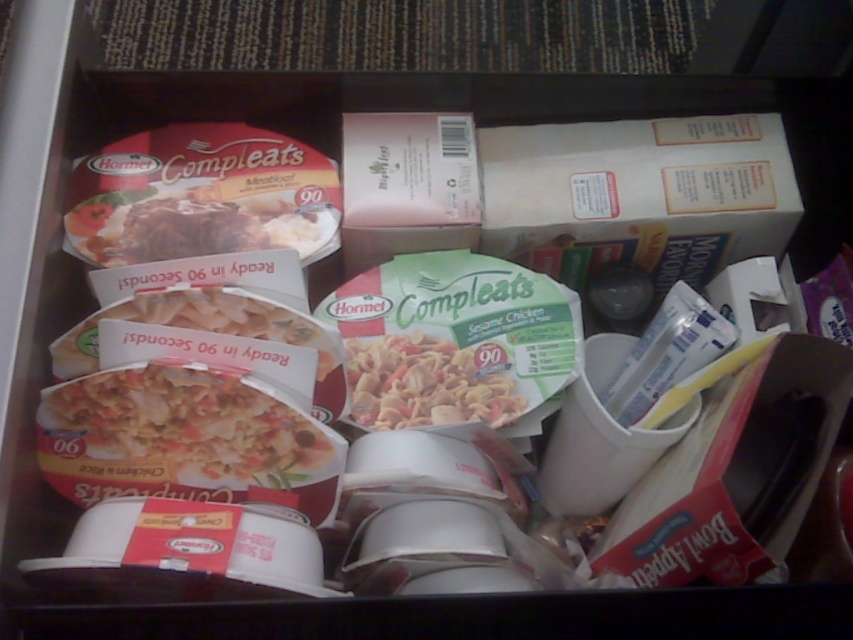
Question: Can you confirm if matte plastic compleats meal at center is thinner than green matte compleats bowl at center?

Choices:
 (A) no
 (B) yes

Answer: (A)

Question: Does white matte compleats at center appear over matte plastic compleats meal at center?

Choices:
 (A) no
 (B) yes

Answer: (A)

Question: Which object is the farthest from the white matte compleats at center?

Choices:
 (A) matte plastic compleats meal at center
 (B) green matte compleats bowl at center

Answer: (A)

Question: Does white matte compleats at center have a greater width compared to green matte compleats bowl at center?

Choices:
 (A) no
 (B) yes

Answer: (B)

Question: Which of the following is the closest to the observer?

Choices:
 (A) (245, 224)
 (B) (364, 353)

Answer: (B)

Question: Which of the following is the farthest from the observer?

Choices:
 (A) green matte compleats bowl at center
 (B) white matte compleats at center

Answer: (A)